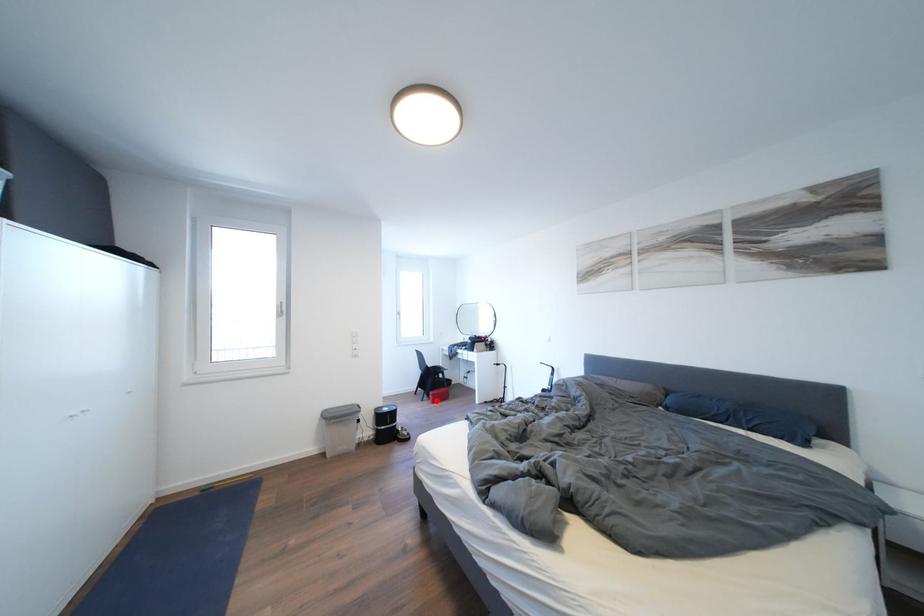
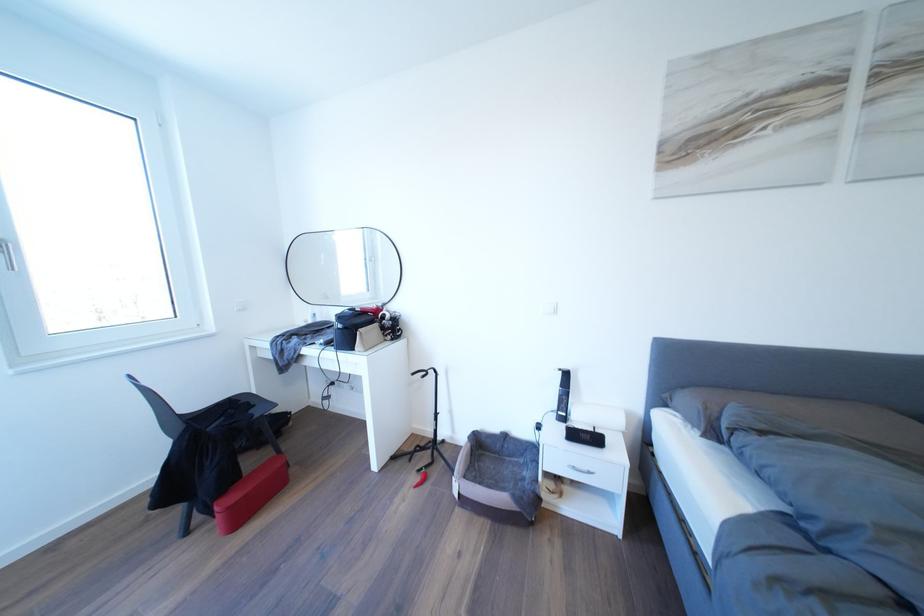
In the second image, find the point that corresponds to the highlighted location in the first image.

(217, 519)